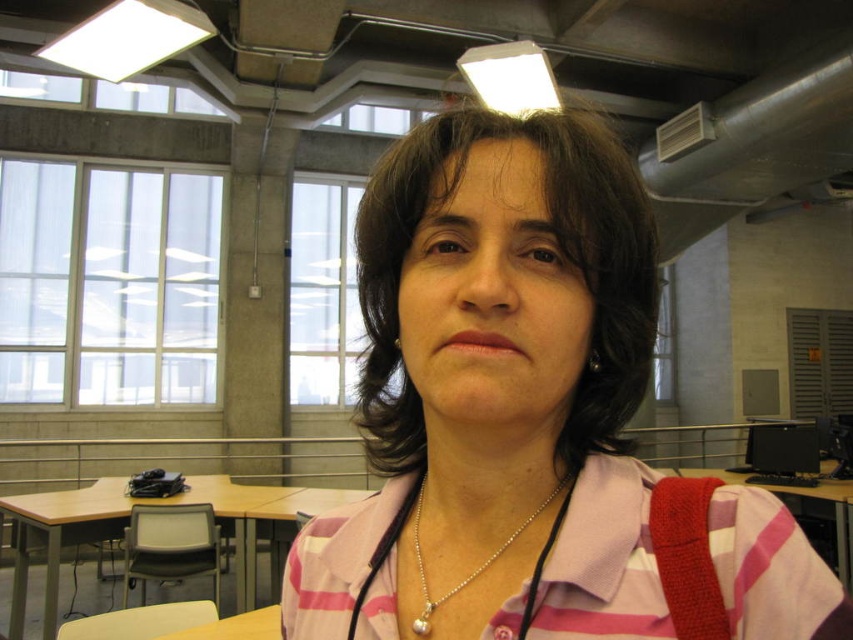
You are standing in the classroom and want to reach the point at coordinates point (90, 524). If you move straight towards it from your current position, how far will you have to walk?

The distance between you and the point (90, 524) is 3.13 meters, so you will have to walk 3.13 meters to reach it.

You are a delivery person who needs to place a package between the brown wooden table at lower left and the wooden table at right. The package requires 7 feet of space. Is there enough space between them?

The brown wooden table at lower left and wooden table at right are 6.93 feet apart from each other, so there is not enough space to place the package requiring 7 feet of space between them.